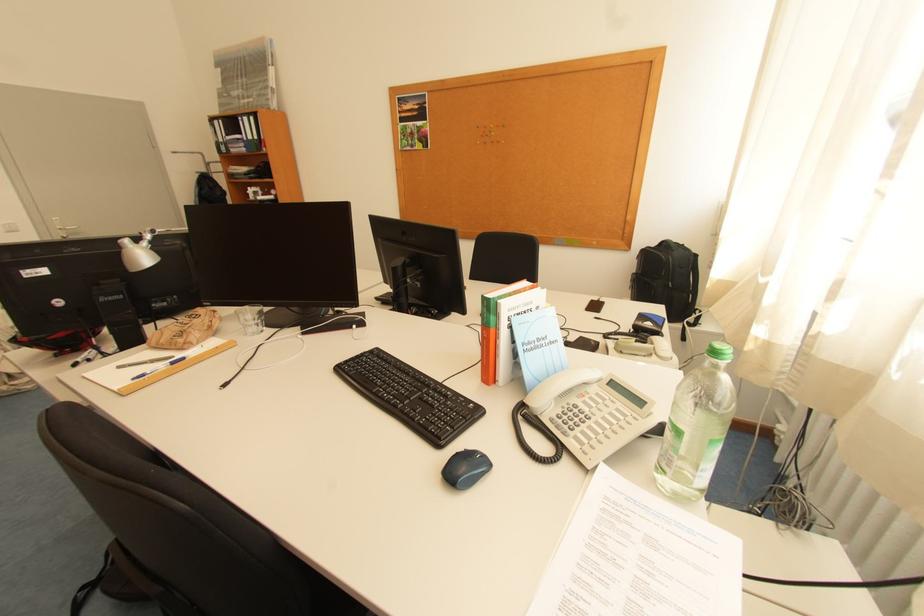
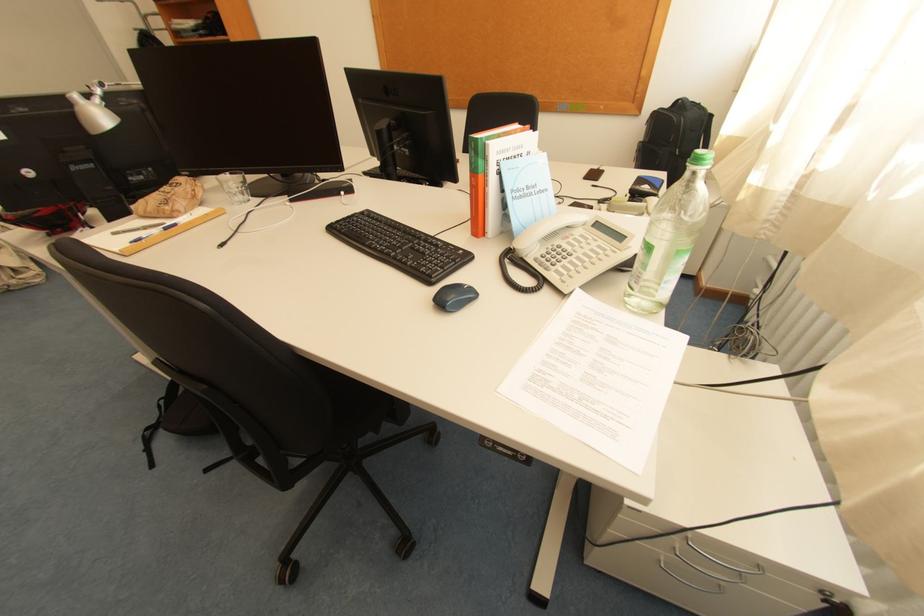
Where in the second image is the point corresponding to the point at 573,435 from the first image?

(554, 270)